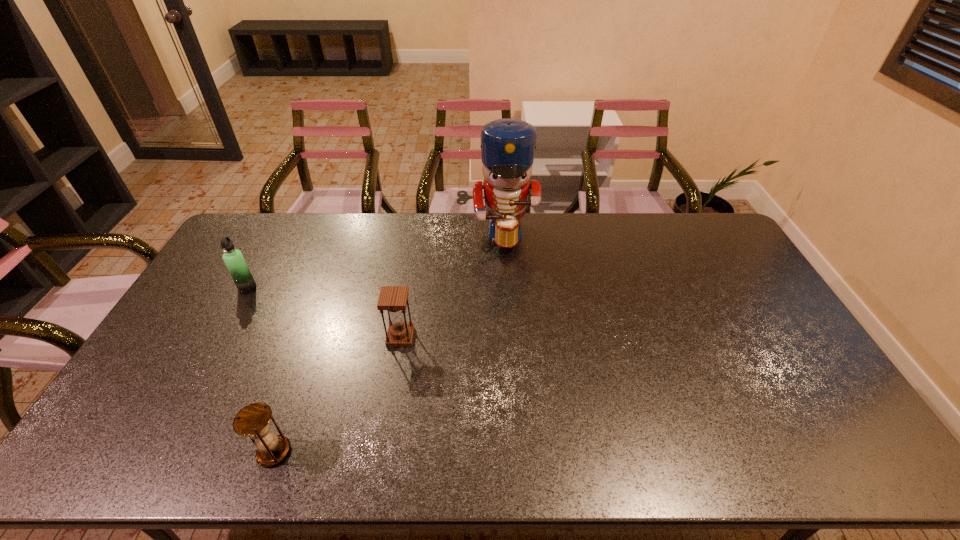
This screenshot has height=540, width=960. Find the location of `free space located 0.380m on the right of the right hourglass`. free space located 0.380m on the right of the right hourglass is located at coordinates (540, 337).

Where is `free spot located 0.250m on the left of the nearest object`? This screenshot has height=540, width=960. free spot located 0.250m on the left of the nearest object is located at coordinates (154, 452).

You are a GUI agent. You are given a task and a screenshot of the screen. Output one action in this format:
    pyautogui.click(x=<x>, y=<y>)
    Task: Click on the object that is positioned at the far edge
    This screenshot has width=960, height=540.
    Given the screenshot: What is the action you would take?
    pyautogui.click(x=508, y=145)

Where is `object at the near edge`? This screenshot has height=540, width=960. object at the near edge is located at coordinates (253, 420).

The width and height of the screenshot is (960, 540). Identify the location of object that is at the left edge. (233, 258).

Image resolution: width=960 pixels, height=540 pixels. Find the location of `free space at the far edge of the desktop`. free space at the far edge of the desktop is located at coordinates (655, 213).

At what (x,y) coordinates should I click in order to perform the action: click on free space at the near edge. Please return your answer as a coordinate pair (x, y). Looking at the image, I should click on (358, 461).

Identify the location of vacant space at the left edge. (211, 284).

I want to click on free space at the right edge of the desktop, so click(x=789, y=352).

I want to click on vacant space at the far right corner, so click(691, 241).